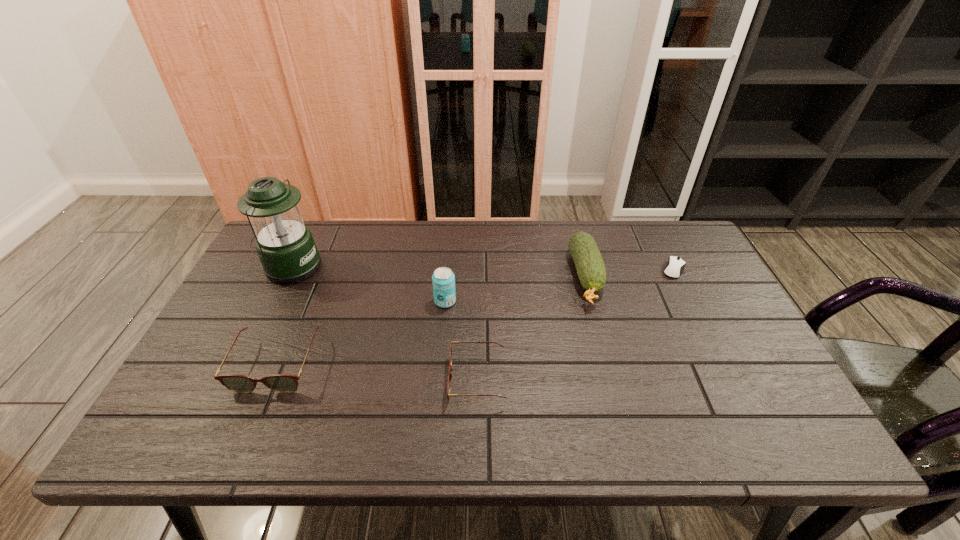
Identify the location of the third shortest object. The height and width of the screenshot is (540, 960). (282, 383).

Identify the location of the taller spectacles. This screenshot has width=960, height=540. (282, 383).

At what (x,y) coordinates should I click in order to perform the action: click on the shorter spectacles. Please return your answer as a coordinate pair (x, y). The height and width of the screenshot is (540, 960). Looking at the image, I should click on (451, 342).

Locate an element on the screen. The image size is (960, 540). the second shortest object is located at coordinates (451, 342).

The height and width of the screenshot is (540, 960). Identify the location of lantern. (285, 245).

Find the location of `the fifth shortest object`. the fifth shortest object is located at coordinates (443, 279).

You are a GUI agent. You are given a task and a screenshot of the screen. Output one action in this format:
    pyautogui.click(x=<x>, y=<y>)
    Task: Click on the mouse
    The width and height of the screenshot is (960, 540).
    Given the screenshot: What is the action you would take?
    pyautogui.click(x=675, y=266)

Where is `the rightmost object`? The image size is (960, 540). the rightmost object is located at coordinates (675, 266).

Locate an element on the screen. the fifth object from left to right is located at coordinates (590, 267).

Where is `cucumber`? The image size is (960, 540). cucumber is located at coordinates (590, 267).